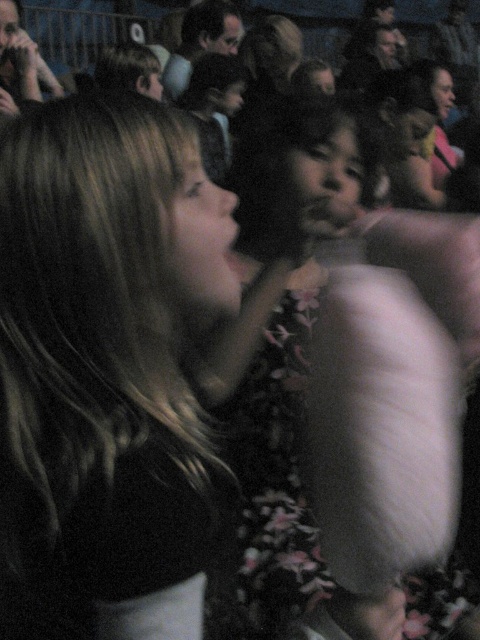
Can you confirm if dark brown hair at center is bigger than fluffy white dress at center?

No, dark brown hair at center is not bigger than fluffy white dress at center.

The height and width of the screenshot is (640, 480). What do you see at coordinates (98, 355) in the screenshot?
I see `dark brown hair at center` at bounding box center [98, 355].

In order to click on dark brown hair at center in this screenshot , I will do `click(98, 355)`.